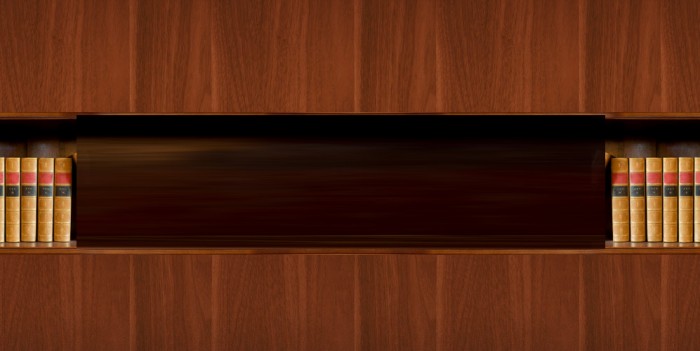
At what (x,y) coordinates should I click in order to perform the action: click on books on right side of shelf. Please return your answer as a coordinate pair (x, y). This screenshot has height=351, width=700. Looking at the image, I should click on (x=620, y=205), (x=637, y=198), (x=649, y=199), (x=668, y=204), (x=680, y=203), (x=694, y=202).